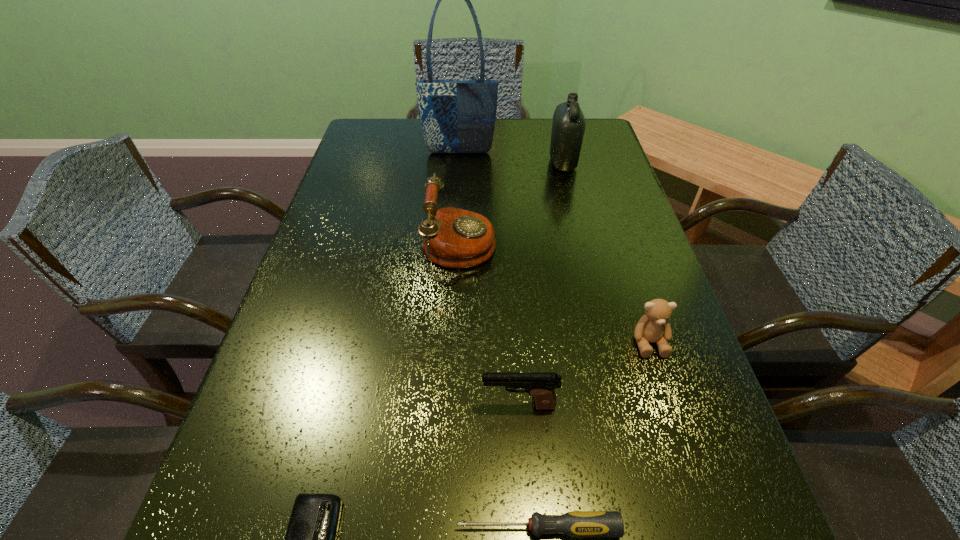
You are a GUI agent. You are given a task and a screenshot of the screen. Output one action in this format:
    pyautogui.click(x=<x>, y=<y>)
    Task: Click on the blank space that satisfies the following two spatial constraints: 1. on the front-facing side of the sixth object from left to right; 2. on the left side of the shopping bag
    The image size is (960, 540).
    Given the screenshot: What is the action you would take?
    pyautogui.click(x=459, y=163)